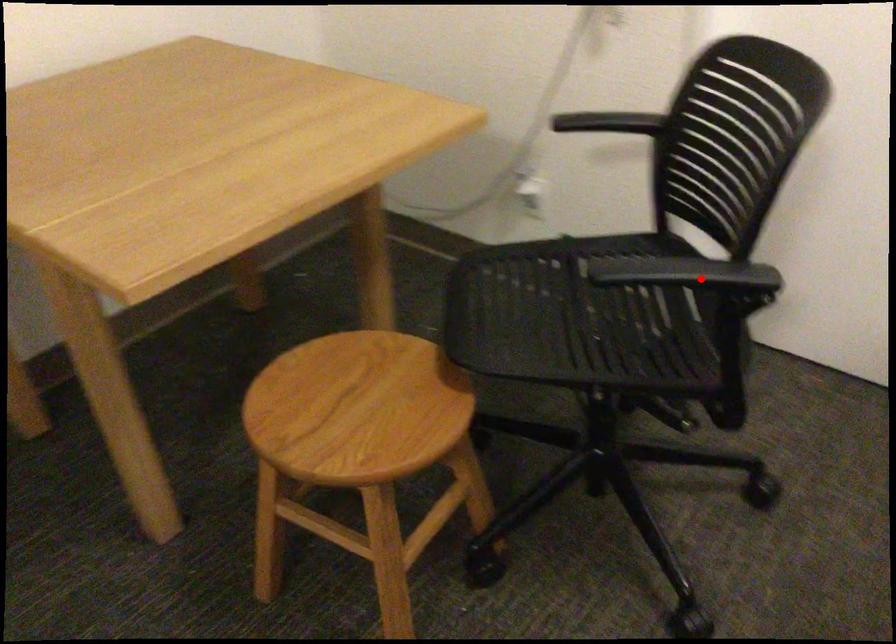
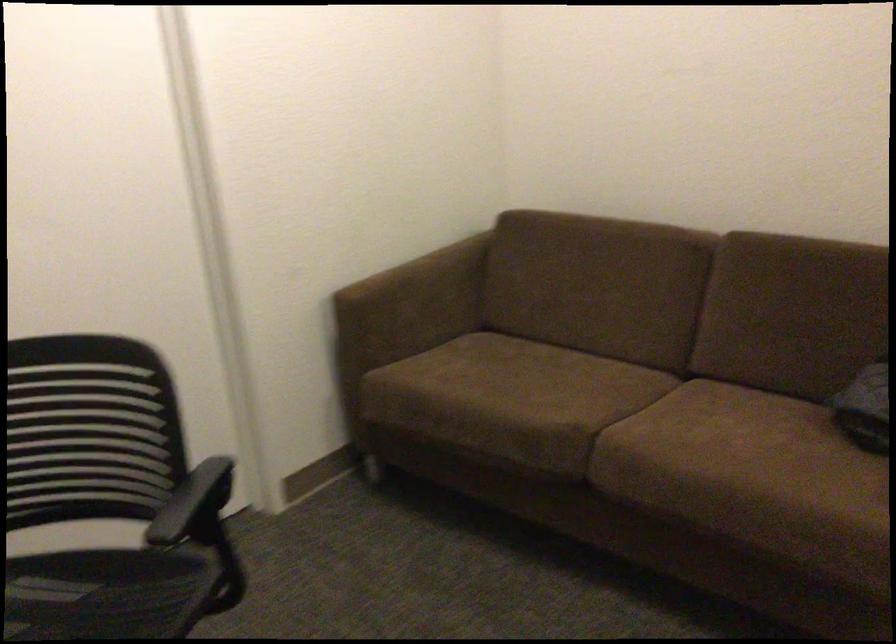
The point at the highlighted location is marked in the first image. Where is the corresponding point in the second image?

(192, 500)